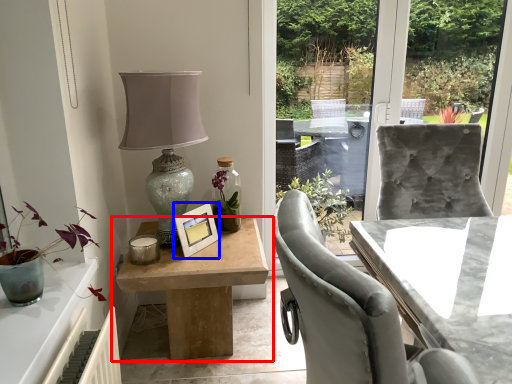
Question: Which object is closer to the camera taking this photo, table (highlighted by a red box) or picture frame (highlighted by a blue box)?

Choices:
 (A) table
 (B) picture frame

Answer: (A)